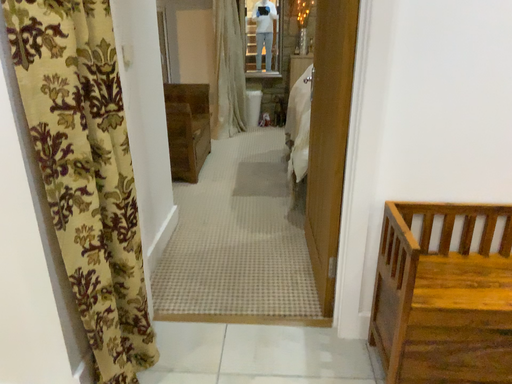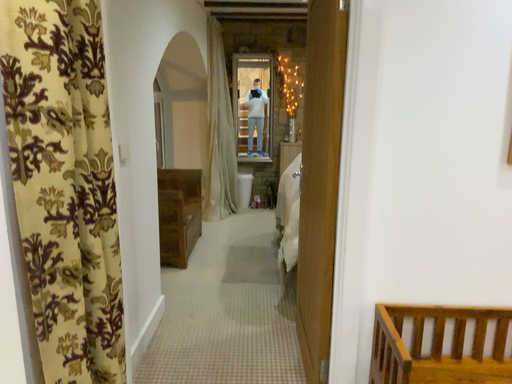
Question: How did the camera likely rotate when shooting the video?

Choices:
 (A) rotated upward
 (B) rotated downward

Answer: (A)